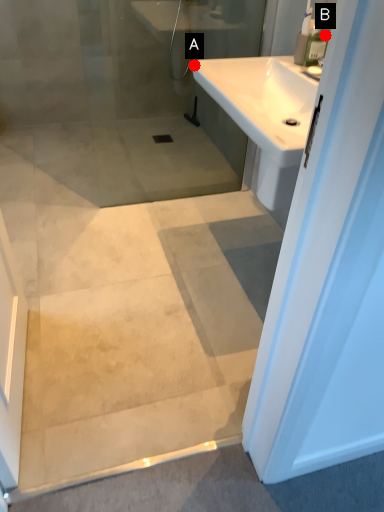
Question: Two points are circled on the image, labeled by A and B beside each circle. Which point is farther from the camera taking this photo?

Choices:
 (A) A is further
 (B) B is further

Answer: (A)